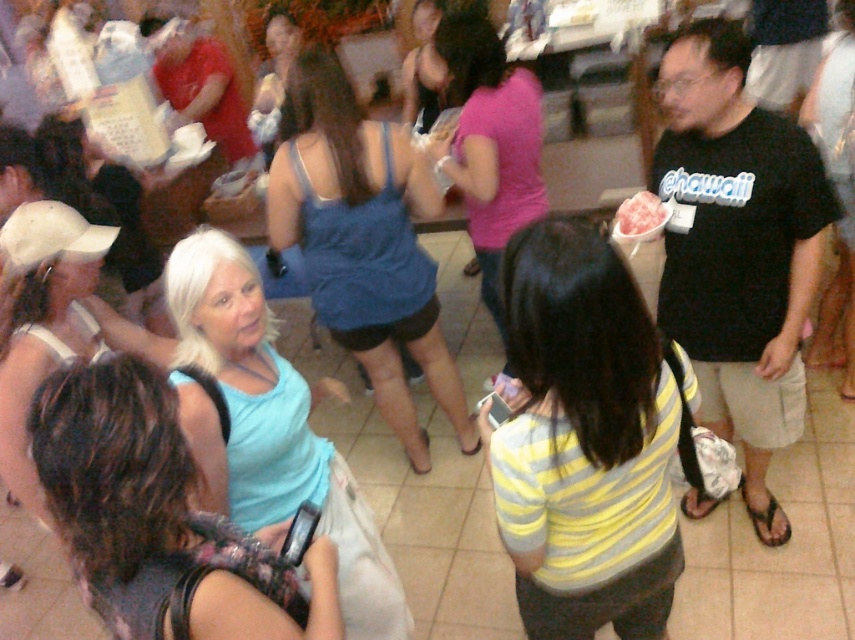
Question: Is the position of light blue fabric dress at center more distant than that of pink frosted cake at center?

Choices:
 (A) no
 (B) yes

Answer: (A)

Question: Estimate the real-world distances between objects in this image. Which object is closer to the blue fabric tank top at center?

Choices:
 (A) striped cotton shirt at center
 (B) matte blue tank top at center
 (C) pink frosted cake at center

Answer: (B)

Question: Estimate the real-world distances between objects in this image. Which object is closer to the light blue fabric tank top at center?

Choices:
 (A) matte blue tank top at center
 (B) light blue fabric dress at center
 (C) striped cotton shirt at center
 (D) blue fabric tank top at center

Answer: (C)

Question: Where is striped cotton shirt at center located in relation to blue fabric tank top at center in the image?

Choices:
 (A) left
 (B) right

Answer: (B)

Question: Can you confirm if striped cotton shirt at center is positioned below matte blue tank top at center?

Choices:
 (A) yes
 (B) no

Answer: (A)

Question: Estimate the real-world distances between objects in this image. Which object is closer to the light blue fabric tank top at center?

Choices:
 (A) light blue fabric dress at center
 (B) striped cotton shirt at center
 (C) pink frosted cake at center
 (D) matte blue tank top at center

Answer: (B)